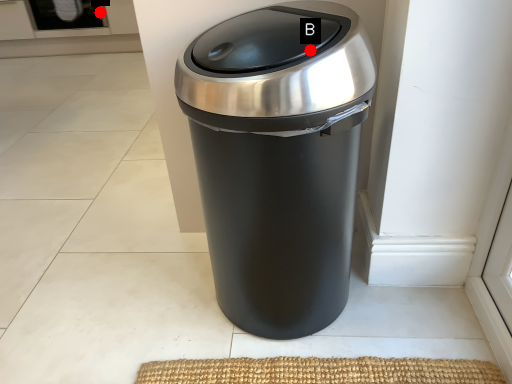
Question: Two points are circled on the image, labeled by A and B beside each circle. Which point appears closest to the camera in this image?

Choices:
 (A) A is closer
 (B) B is closer

Answer: (B)